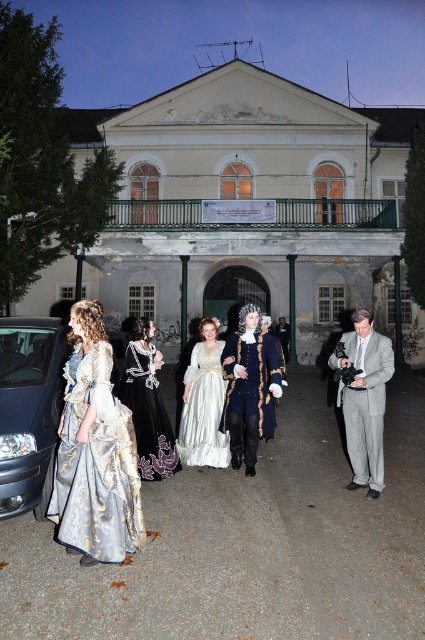
You are a photographer planning to take a portrait of the gray fabric suit at right and the shiny black car at left. Which object should you focus on first if you want to capture both in a single frame without moving the camera?

You should focus on the gray fabric suit at right first because it is taller than the shiny black car at left, allowing you to adjust the camera settings for the taller subject first.

You are a photographer standing in front of the old building. You want to take a photo that includes both the shiny black car at left and the gray fabric suit at right. Which object should you adjust your camera angle to focus on first to ensure both are in the frame?

The shiny black car at left is located above the gray fabric suit at right. To ensure both are in the frame, focus on the shiny black car at left first since it is higher up, then adjust downward to include the gray fabric suit at right.